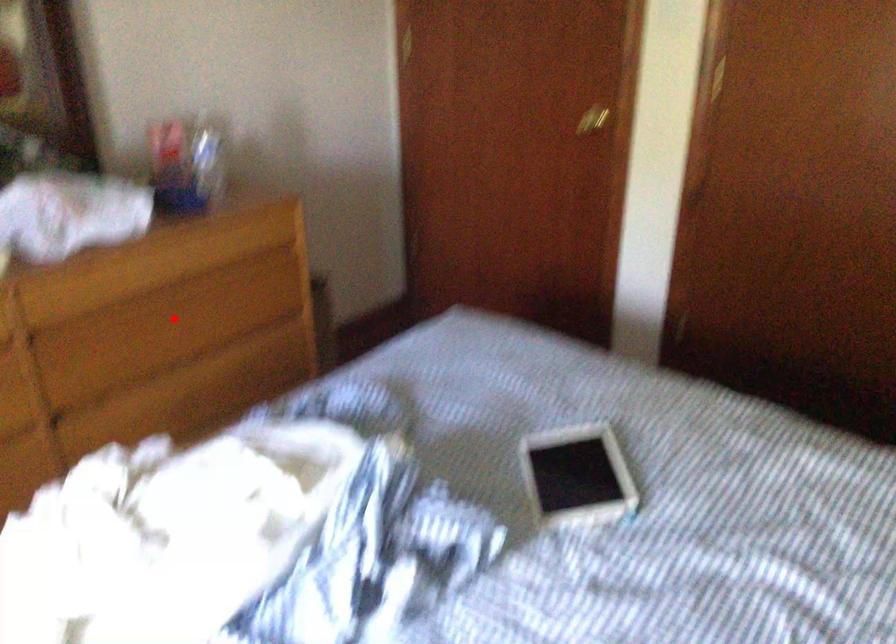
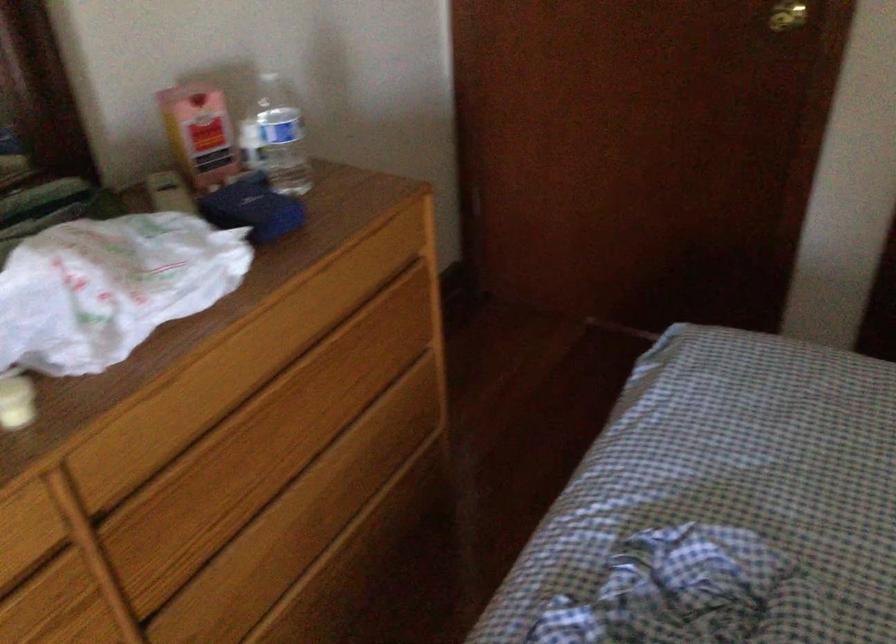
In the second image, find the point that corresponds to the highlighted location in the first image.

(291, 413)